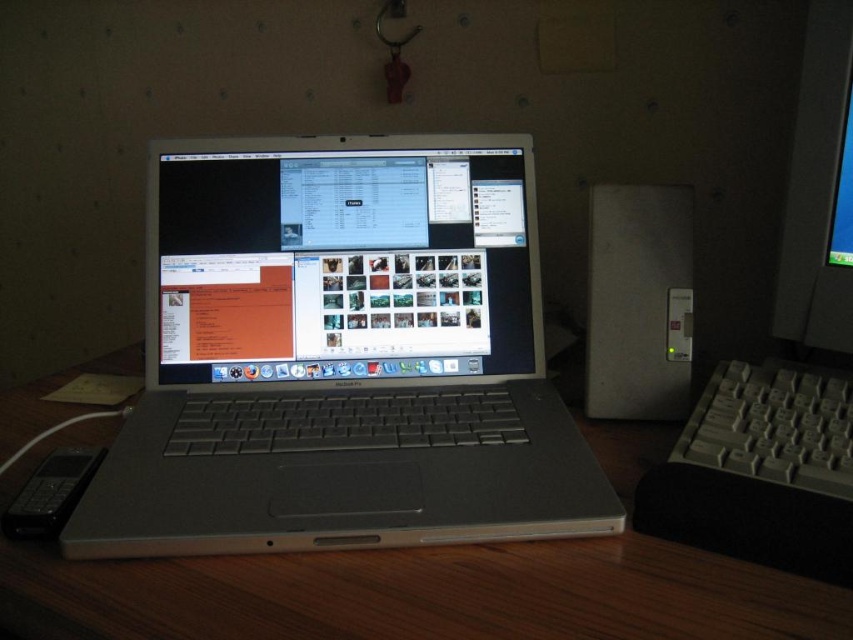
You are organizing your desk and want to place a new mouse pad between the satin silver laptop at center and the white plastic keyboard at right. Based on their positions, where should the mouse pad be placed relative to the laptop?

The satin silver laptop at center is above the white plastic keyboard at right, so the mouse pad should be placed below the laptop to align with the keyboard.

You are setting up a new wireless keyboard that requires a clear line of sight to the laptop. The keyboard is placed on the desk at position point A. Given the silver metallic laptop at center is at coordinates point B, which is at position point B, can you determine if the keyboard will function properly with the laptop?

The silver metallic laptop at center is located at point B, so the keyboard placed at point A must have a clear line of sight to point B for proper functionality. Without knowing the exact positions of points A and B, it is impossible to confirm if there are any obstructions between them. However, based on the provided coordinates, if point A is within the desk area and there are no objects blocking the path between point A and point B, the keyboard should work properly.